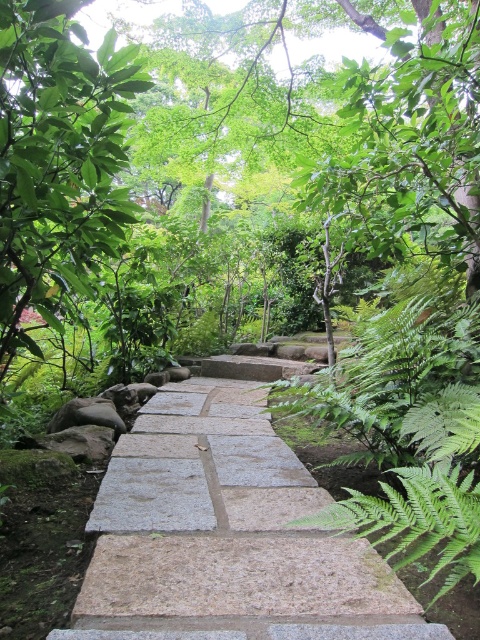
Question: Which of the following is the closest to the observer?

Choices:
 (A) (159, 513)
 (B) (96, 144)

Answer: (A)

Question: Is gray stone path at center to the right of green leafy tree at upper left from the viewer's perspective?

Choices:
 (A) no
 (B) yes

Answer: (B)

Question: Can you confirm if gray stone path at center is bigger than green leafy tree at upper left?

Choices:
 (A) yes
 (B) no

Answer: (B)

Question: Is gray stone path at center to the left of green leafy tree at upper left from the viewer's perspective?

Choices:
 (A) yes
 (B) no

Answer: (B)

Question: Which point is closer to the camera?

Choices:
 (A) (26, 344)
 (B) (152, 483)

Answer: (A)